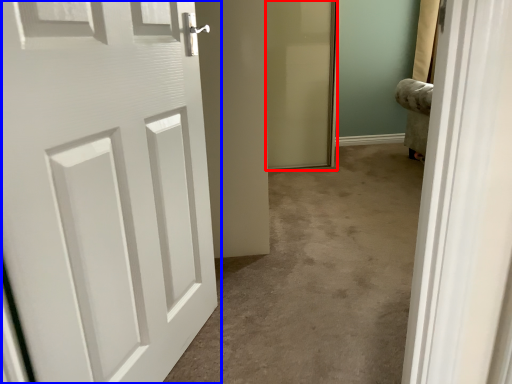
Question: Among these objects, which one is nearest to the camera, screen door (highlighted by a red box) or door (highlighted by a blue box)?

Choices:
 (A) screen door
 (B) door

Answer: (B)